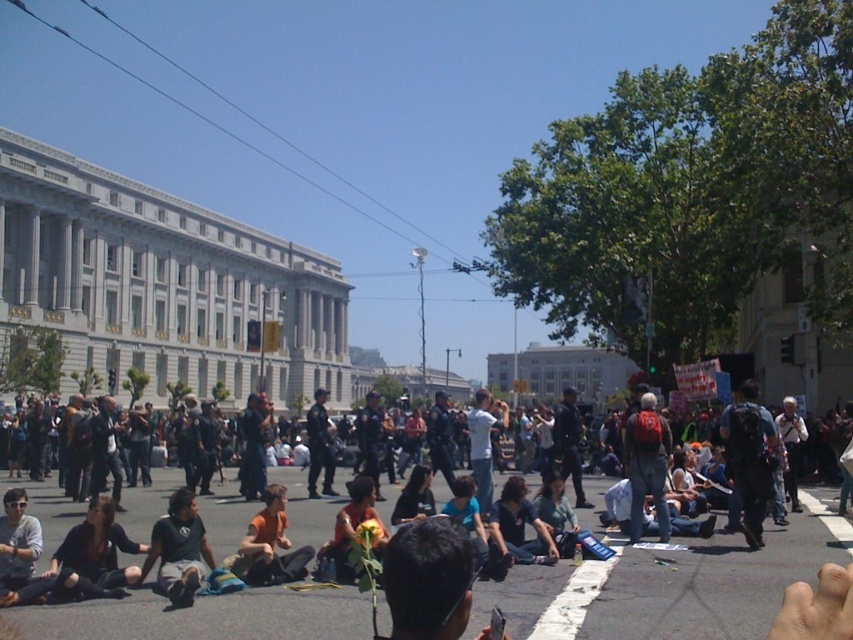
Does dark green t-shirt at lower left appear over red backpack at center?

Incorrect, dark green t-shirt at lower left is not positioned above red backpack at center.

Does dark green t-shirt at lower left have a lesser width compared to red backpack at center?

Yes, dark green t-shirt at lower left is thinner than red backpack at center.

Find the location of a particular element. This screenshot has width=853, height=640. dark green t-shirt at lower left is located at coordinates (178, 550).

Does dark blue jeans at lower center appear over red backpack at center?

No.

Who is positioned more to the right, dark blue jeans at lower center or red backpack at center?

red backpack at center is more to the right.

The width and height of the screenshot is (853, 640). What do you see at coordinates (660, 588) in the screenshot?
I see `dark blue jeans at lower center` at bounding box center [660, 588].

Locate an element on the screen. The width and height of the screenshot is (853, 640). dark blue jeans at lower center is located at coordinates pyautogui.click(x=660, y=588).

Between red backpack at center and dark blue shirt at center, which one is positioned lower?

dark blue shirt at center is lower down.

Who is more forward, (631, 486) or (503, 525)?

Point (503, 525) is more forward.

Is point (653, 497) positioned in front of point (547, 532)?

That is False.

This screenshot has width=853, height=640. I want to click on red backpack at center, so click(647, 465).